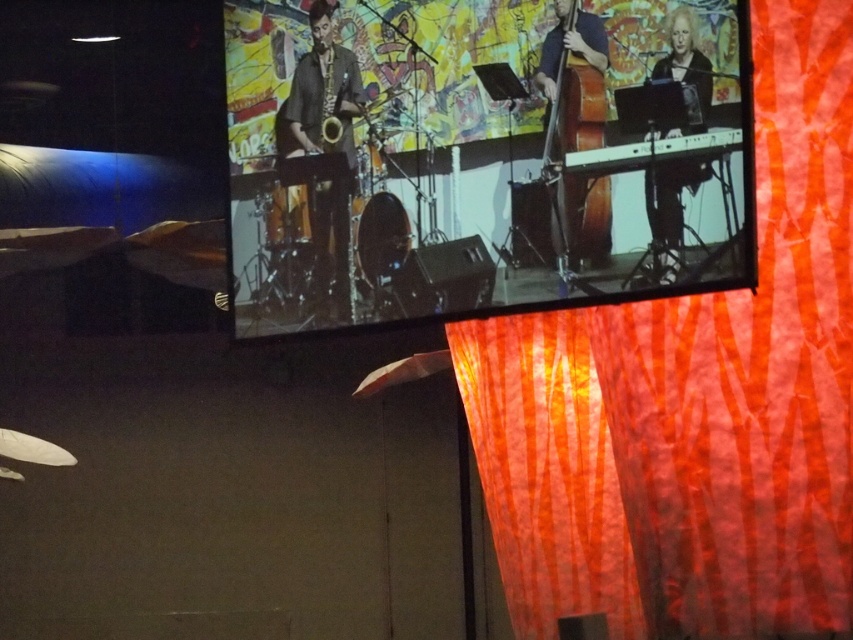
Between matte black screen at upper center and matte black keyboard at right, which one has more height?

Standing taller between the two is matte black screen at upper center.

I want to click on matte black screen at upper center, so click(x=483, y=156).

Can you confirm if shiny gold saxophone at center is positioned to the left of matte black keyboard at right?

Yes, shiny gold saxophone at center is to the left of matte black keyboard at right.

Who is lower down, shiny gold saxophone at center or matte black keyboard at right?

matte black keyboard at right

Is point (345, 204) closer to viewer compared to point (654, 266)?

No, it is not.

Where is `shiny gold saxophone at center`? The height and width of the screenshot is (640, 853). shiny gold saxophone at center is located at coordinates (326, 148).

Does orange striped fabric at right appear over matte black keyboard at right?

Actually, orange striped fabric at right is below matte black keyboard at right.

Between point (485, 429) and point (680, 36), which one is positioned in front?

Positioned in front is point (680, 36).

Is point (560, 484) farther from camera compared to point (682, 129)?

That is True.

Find the location of a particular element. The image size is (853, 640). orange striped fabric at right is located at coordinates (693, 403).